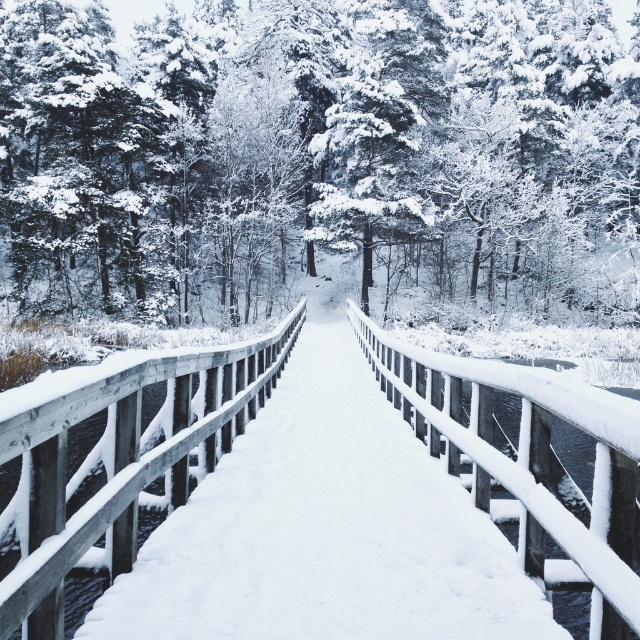
You are a painter who wants to paint the white wooden rail at left and the white wooden rail at center accurately. Which rail should you focus on more if you need to depict the wider rail in your painting?

The white wooden rail at left is wider than the white wooden rail at center, so you should focus more on painting the white wooden rail at left to accurately depict its wider width.

You are standing on the snow covered ground near the white wooden rail at left and want to cross the stream. Is the white wooden bridge at center a suitable path to cross the stream?

The white wooden bridge at center is located above the white wooden rail at left, which suggests that the bridge spans over the stream and is a suitable path to cross it.